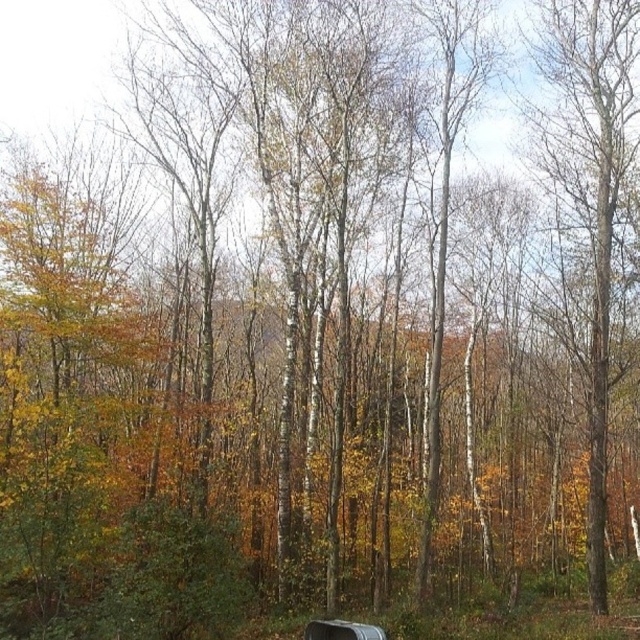
You are a hiker who wants to sit on the metallic silver bench at lower center. Which direction should you walk to avoid the smooth bark tree at right?

You should walk to the left to avoid the smooth bark tree at right, as it is located to the right of the metallic silver bench at lower center.

You are planning to place a new bench in the forest that is as wide as the metallic silver bench at lower center. The smooth bark tree at right is in the way. Can the bench be placed next to the tree without overlapping?

The smooth bark tree at right has a lesser width compared to the metallic silver bench at lower center. Since the bench is as wide as the existing one, placing it next to the tree may not leave enough space. Consider moving the bench further away or choosing a narrower bench.